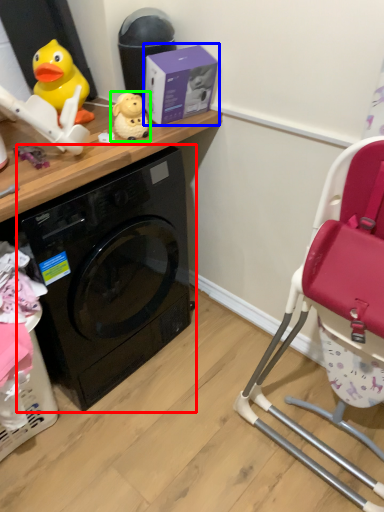
Question: Based on their relative distances, which object is farther from washing machine (highlighted by a red box)? Choose from box (highlighted by a blue box) and toy (highlighted by a green box).

Choices:
 (A) box
 (B) toy

Answer: (B)